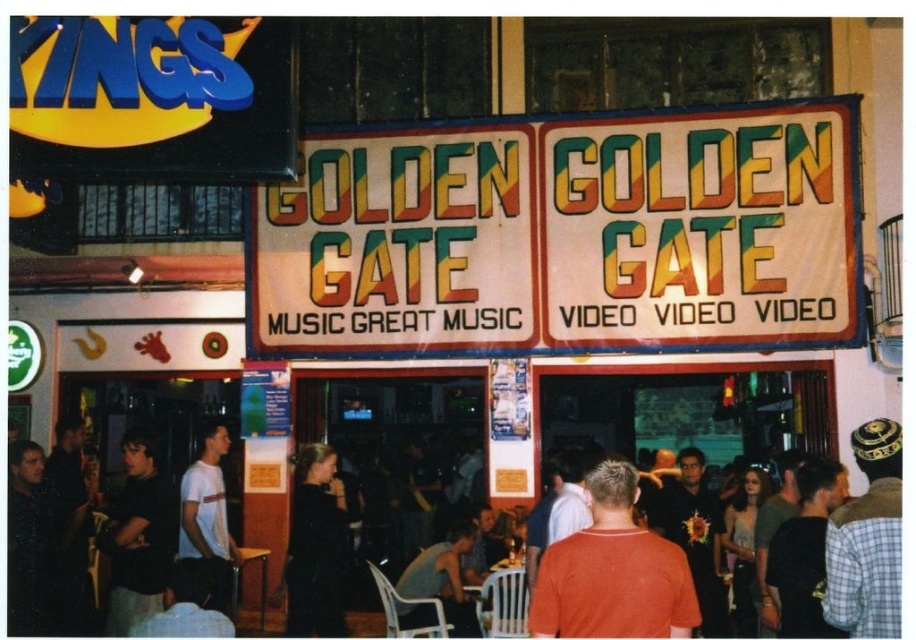
Which is below, black matte dress at center or white matte t-shirt at center?

white matte t-shirt at center

In the scene shown: Does black matte dress at center appear on the right side of white matte t-shirt at center?

Yes, black matte dress at center is to the right of white matte t-shirt at center.

Is point (331, 500) farther from viewer compared to point (237, 554)?

No, it is not.

Where is `black matte dress at center`? black matte dress at center is located at coordinates (314, 547).

Between point (570, 634) and point (291, 582), which one is positioned behind?

The point (291, 582) is behind.

Image resolution: width=916 pixels, height=640 pixels. What do you see at coordinates (612, 572) in the screenshot? I see `orange t-shirt at center` at bounding box center [612, 572].

Image resolution: width=916 pixels, height=640 pixels. I want to click on orange t-shirt at center, so click(x=612, y=572).

Is orange t-shirt at center positioned in front of white matte t-shirt at center?

Yes, orange t-shirt at center is in front of white matte t-shirt at center.

Does orange t-shirt at center appear over white matte t-shirt at center?

Yes.

I want to click on orange t-shirt at center, so click(x=612, y=572).